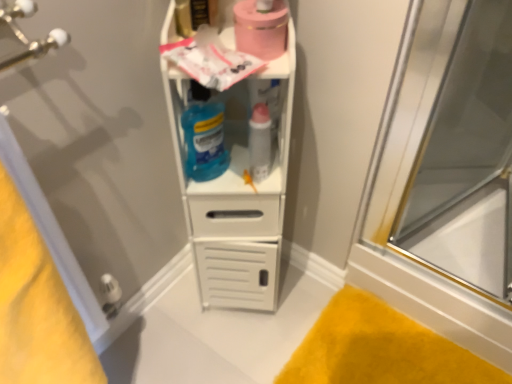
Question: From a real-world perspective, is pink matte toilet paper at upper center positioned under transparent glass screen door at left based on gravity?

Choices:
 (A) no
 (B) yes

Answer: (A)

Question: Does pink matte toilet paper at upper center have a lesser height compared to transparent glass screen door at left?

Choices:
 (A) no
 (B) yes

Answer: (B)

Question: Considering the relative sizes of pink matte toilet paper at upper center and transparent glass screen door at left in the image provided, is pink matte toilet paper at upper center bigger than transparent glass screen door at left?

Choices:
 (A) yes
 (B) no

Answer: (B)

Question: Can you confirm if pink matte toilet paper at upper center is thinner than transparent glass screen door at left?

Choices:
 (A) no
 (B) yes

Answer: (B)

Question: From a real-world perspective, is pink matte toilet paper at upper center on top of transparent glass screen door at left?

Choices:
 (A) no
 (B) yes

Answer: (B)

Question: Can transparent glass screen door at left be found inside pink matte toilet paper at upper center?

Choices:
 (A) no
 (B) yes

Answer: (A)

Question: Is the depth of translucent blue liquid at center less than that of pink matte toilet paper at upper center?

Choices:
 (A) yes
 (B) no

Answer: (B)

Question: Is there a large distance between translucent blue liquid at center and pink matte toilet paper at upper center?

Choices:
 (A) no
 (B) yes

Answer: (A)

Question: From a real-world perspective, is translucent blue liquid at center located higher than pink matte toilet paper at upper center?

Choices:
 (A) yes
 (B) no

Answer: (B)

Question: Is translucent blue liquid at center oriented away from pink matte toilet paper at upper center?

Choices:
 (A) no
 (B) yes

Answer: (A)

Question: Are translucent blue liquid at center and pink matte toilet paper at upper center making contact?

Choices:
 (A) no
 (B) yes

Answer: (A)

Question: Does translucent blue liquid at center have a lesser height compared to pink matte toilet paper at upper center?

Choices:
 (A) yes
 (B) no

Answer: (B)

Question: Is the position of transparent glass door at right less distant than that of translucent blue liquid at center?

Choices:
 (A) yes
 (B) no

Answer: (A)